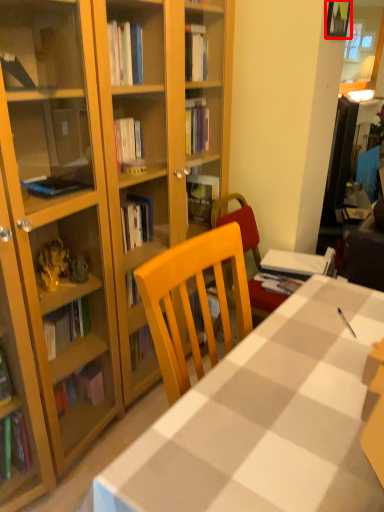
Question: From the image's perspective, what is the correct spatial positioning of picture frame (annotated by the red box) in reference to desk?

Choices:
 (A) below
 (B) above

Answer: (B)